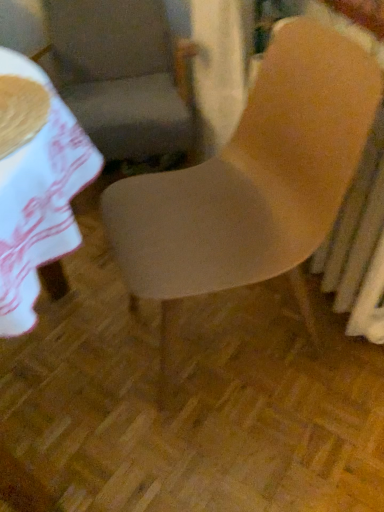
Where is `free spot below matte wood chair at center, the second chair positioned from the back (from a real-world perspective)`? The width and height of the screenshot is (384, 512). free spot below matte wood chair at center, the second chair positioned from the back (from a real-world perspective) is located at coordinates (230, 336).